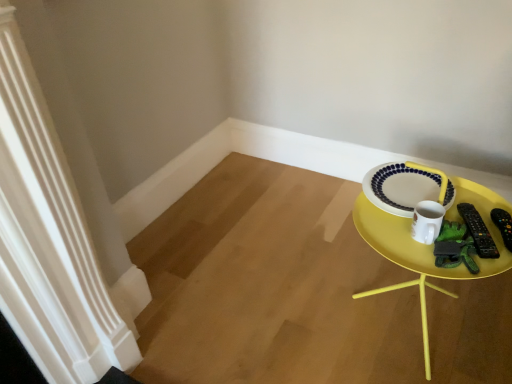
What do you see at coordinates (429, 245) in the screenshot? The image size is (512, 384). I see `yellow plastic tray at right` at bounding box center [429, 245].

The height and width of the screenshot is (384, 512). In order to click on black plastic remote control at right, the second remote control from the left in this screenshot , I will do `click(503, 225)`.

In order to face black plastic remote control at right, the 1th remote control in the right-to-left sequence, should I rotate leftwards or rightwards?

Rotate your view right by about 30.558°.

Locate an element on the screen. This screenshot has height=384, width=512. white glossy mug at right is located at coordinates (426, 221).

Where is `yellow plastic tray at right`? This screenshot has height=384, width=512. yellow plastic tray at right is located at coordinates (429, 245).

Can you confirm if white glossy mug at right is thinner than black plastic remote control at right, the 1th remote control from the left?

Correct, the width of white glossy mug at right is less than that of black plastic remote control at right, the 1th remote control from the left.

From a real-world perspective, is white glossy mug at right above or below black plastic remote control at right, the 1th remote control from the left?

In terms of real-world spatial position, white glossy mug at right is above black plastic remote control at right, the 1th remote control from the left.

Looking at this image, how far apart are white glossy mug at right and yellow plastic tray at right?

white glossy mug at right is 4.08 inches away from yellow plastic tray at right.

From a real-world perspective, is white glossy mug at right physically below yellow plastic tray at right?

Incorrect, from a real-world perspective, white glossy mug at right is higher than yellow plastic tray at right.

Could you tell me if white glossy mug at right is turned towards yellow plastic tray at right?

Yes, white glossy mug at right is facing yellow plastic tray at right.

Which is less distant, (430,203) or (421,278)?

The point (430,203) is in front.

Is black plastic remote control at right, the 1th remote control in the right-to-left sequence, aimed at black plastic remote control at right, the 1th remote control from the left?

No.

How different are the orientations of black plastic remote control at right, the 1th remote control in the right-to-left sequence, and black plastic remote control at right, which is the second remote control from right to left, in degrees?

The angle between the facing direction of black plastic remote control at right, the 1th remote control in the right-to-left sequence, and the facing direction of black plastic remote control at right, which is the second remote control from right to left, is 0.00105 degrees.

Is black plastic remote control at right, the 1th remote control in the right-to-left sequence, with black plastic remote control at right, the 1th remote control from the left?

Yes, black plastic remote control at right, the 1th remote control in the right-to-left sequence, is in contact with black plastic remote control at right, the 1th remote control from the left.

From the image's perspective, would you say black plastic remote control at right, the 1th remote control in the right-to-left sequence, is shown under black plastic remote control at right, which is the second remote control from right to left?

Yes, from the image's perspective, black plastic remote control at right, the 1th remote control in the right-to-left sequence, is beneath black plastic remote control at right, which is the second remote control from right to left.

Based on the photo, between white glossy mug at right and black plastic remote control at right, the second remote control from the left, which one appears on the left side from the viewer's perspective?

Positioned to the left is white glossy mug at right.

From a real-world perspective, starting from the white glossy mug at right, which remote control is the 2nd one below it? Please provide its 2D coordinates.

[(503, 225)]

Which is nearer, (428, 243) or (493, 212)?

Point (428, 243).

Which is more to the right, yellow plastic tray at right or white glossy plate at upper right?

yellow plastic tray at right is more to the right.

How much distance is there between yellow plastic tray at right and white glossy plate at upper right?

yellow plastic tray at right and white glossy plate at upper right are 4.23 inches apart.

Which of these two, yellow plastic tray at right or white glossy plate at upper right, is smaller?

white glossy plate at upper right is smaller.

Is yellow plastic tray at right facing towards white glossy plate at upper right?

No.

The width and height of the screenshot is (512, 384). Identify the location of plate to the left of black plastic remote control at right, the 1th remote control in the right-to-left sequence. (400, 187).

How different are the orientations of white glossy plate at upper right and black plastic remote control at right, the second remote control from the left, in degrees?

There is a 25.8-degree angle between the facing directions of white glossy plate at upper right and black plastic remote control at right, the second remote control from the left.

Which is closer, [384,179] or [507,213]?

Positioned in front is point [507,213].

Based on the photo, considering the sizes of objects white glossy plate at upper right and black plastic remote control at right, the 1th remote control in the right-to-left sequence, in the image provided, who is taller, white glossy plate at upper right or black plastic remote control at right, the 1th remote control in the right-to-left sequence,?

With more height is black plastic remote control at right, the 1th remote control in the right-to-left sequence.

Is there a large distance between black plastic remote control at right, the 1th remote control from the left, and white glossy mug at right?

They are positioned close to each other.

Considering the sizes of black plastic remote control at right, the 1th remote control from the left, and white glossy mug at right in the image, is black plastic remote control at right, the 1th remote control from the left, bigger or smaller than white glossy mug at right?

In the image, black plastic remote control at right, the 1th remote control from the left, appears to be smaller than white glossy mug at right.

From a real-world perspective, is black plastic remote control at right, the 1th remote control from the left, located higher than white glossy mug at right?

No, from a real-world perspective, black plastic remote control at right, the 1th remote control from the left, is not above white glossy mug at right.

Who is more distant, black plastic remote control at right, which is the second remote control from right to left, or white glossy mug at right?

white glossy mug at right is further away from the camera.

Identify the location of remote control that appears in front of the white glossy mug at right. (478, 231).

Locate an element on the screen. This screenshot has height=384, width=512. coffee cup above the yellow plastic tray at right (from a real-world perspective) is located at coordinates (426, 221).

Looking at the image, which one is located further to yellow plastic tray at right, black plastic remote control at right, the 1th remote control in the right-to-left sequence, or black plastic remote control at right, which is the second remote control from right to left?

black plastic remote control at right, the 1th remote control in the right-to-left sequence, is positioned further to the anchor yellow plastic tray at right.

When comparing their distances from white glossy plate at upper right, does white glossy mug at right or black plastic remote control at right, the 1th remote control from the left, seem further?

The object further to white glossy plate at upper right is black plastic remote control at right, the 1th remote control from the left.

From the image, which object appears to be nearer to white glossy plate at upper right, white glossy mug at right or yellow plastic tray at right?

Based on the image, white glossy mug at right appears to be nearer to white glossy plate at upper right.

Estimate the real-world distances between objects in this image. Which object is closer to yellow plastic tray at right, white glossy mug at right or black plastic remote control at right, which is the second remote control from right to left?

white glossy mug at right is positioned closer to the anchor yellow plastic tray at right.

Considering their positions, is yellow plastic tray at right positioned further to black plastic remote control at right, the 1th remote control from the left, than black plastic remote control at right, the second remote control from the left?

The object further to black plastic remote control at right, the 1th remote control from the left, is yellow plastic tray at right.

Which object lies further to the anchor point black plastic remote control at right, which is the second remote control from right to left, yellow plastic tray at right or white glossy mug at right?

Among the two, yellow plastic tray at right is located further to black plastic remote control at right, which is the second remote control from right to left.

Looking at the image, which one is located further to black plastic remote control at right, the 1th remote control from the left, yellow plastic tray at right or white glossy plate at upper right?

The object further to black plastic remote control at right, the 1th remote control from the left, is white glossy plate at upper right.

Estimate the real-world distances between objects in this image. Which object is closer to black plastic remote control at right, the 1th remote control from the left, white glossy plate at upper right or white glossy mug at right?

white glossy mug at right is positioned closer to the anchor black plastic remote control at right, the 1th remote control from the left.

The image size is (512, 384). In order to click on plate between white glossy mug at right and black plastic remote control at right, which is the second remote control from right to left, from left to right in this screenshot , I will do `click(400, 187)`.

Locate an element on the screen. The image size is (512, 384). remote control between yellow plastic tray at right and black plastic remote control at right, the second remote control from the left, in the front-back direction is located at coordinates (478, 231).

Identify the location of coffee cup between yellow plastic tray at right and black plastic remote control at right, the 1th remote control in the right-to-left sequence, from front to back. This screenshot has width=512, height=384. (426, 221).

You are a GUI agent. You are given a task and a screenshot of the screen. Output one action in this format:
    pyautogui.click(x=<x>, y=<y>)
    Task: Click on the remote control between white glossy mug at right and black plastic remote control at right, the 1th remote control in the right-to-left sequence
    
    Given the screenshot: What is the action you would take?
    pyautogui.click(x=478, y=231)